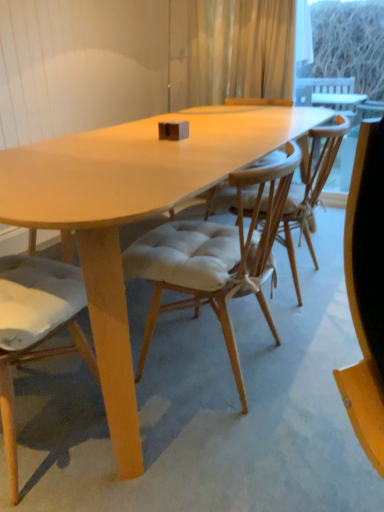
Locate an element on the screen. The width and height of the screenshot is (384, 512). free space in front of light beige fabric chair at center, which is the second chair in left-to-right order is located at coordinates pos(216,452).